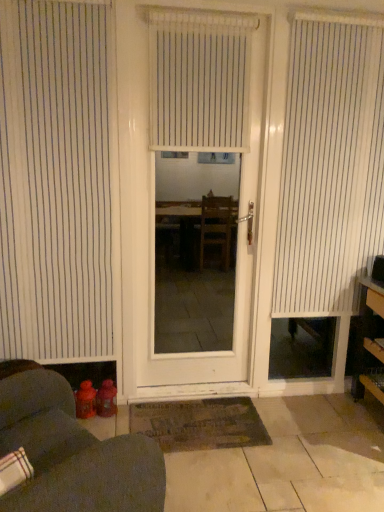
You are a GUI agent. You are given a task and a screenshot of the screen. Output one action in this format:
    pyautogui.click(x=<x>, y=<y>)
    Task: Click on the vacant point above white vertical blinds at center, the second window blind in the right-to-left sequence (from a real-world perspective)
    
    Given the screenshot: What is the action you would take?
    pyautogui.click(x=194, y=16)